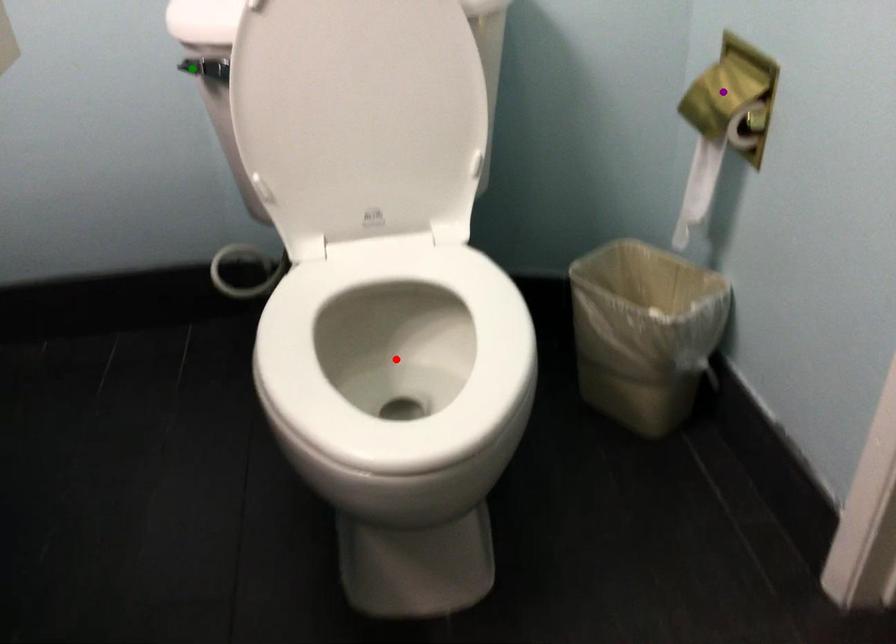
Looking at this image, order these from nearest to farthest:
purple point | green point | red point

1. red point
2. purple point
3. green point